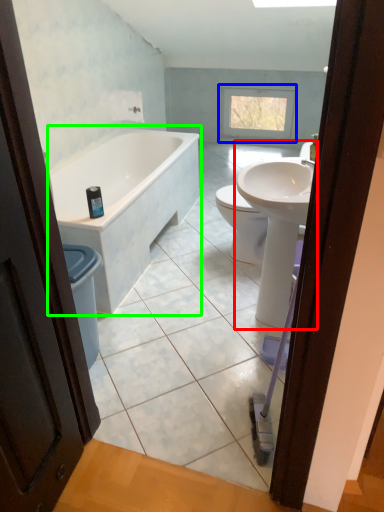
Question: Estimate the real-world distances between objects in this image. Which object is farther from sink (highlighted by a red box), window (highlighted by a blue box) or bathtub (highlighted by a green box)?

Choices:
 (A) window
 (B) bathtub

Answer: (A)